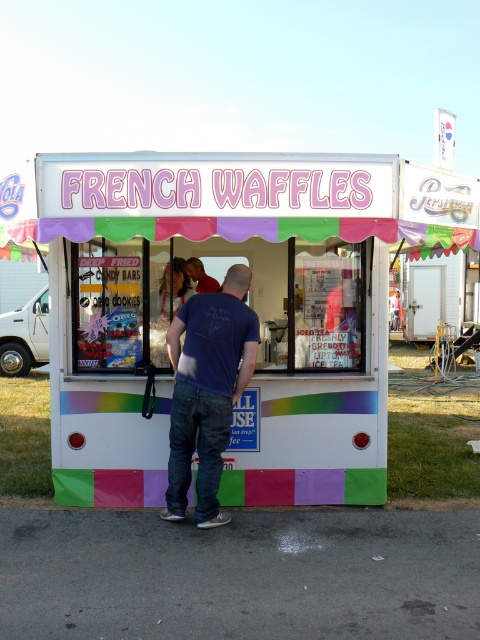
Who is higher up, pastel painted food truck at center or blonde hair at center?

blonde hair at center is higher up.

At what (x,y) coordinates should I click in order to perform the action: click on pastel painted food truck at center. Please return your answer as a coordinate pair (x, y). This screenshot has width=480, height=640. Looking at the image, I should click on (248, 304).

Which is below, pastel painted food truck at center or blue cotton t-shirt at center?

blue cotton t-shirt at center is lower down.

From the picture: Does pastel painted food truck at center have a smaller size compared to blue cotton t-shirt at center?

No.

Does point (55, 449) lie behind point (227, 364)?

Yes, it is.

Identify the location of pastel painted food truck at center. The width and height of the screenshot is (480, 640). (248, 304).

Which of these two, pastel painted food truck at center or blue denim jeans at center, stands shorter?

With less height is blue denim jeans at center.

In the scene shown: Is pastel painted food truck at center behind blue denim jeans at center?

No, pastel painted food truck at center is closer to the viewer.

Locate an element on the screen. The width and height of the screenshot is (480, 640). pastel painted food truck at center is located at coordinates (248, 304).

Locate an element on the screen. Image resolution: width=480 pixels, height=640 pixels. pastel painted food truck at center is located at coordinates (248, 304).